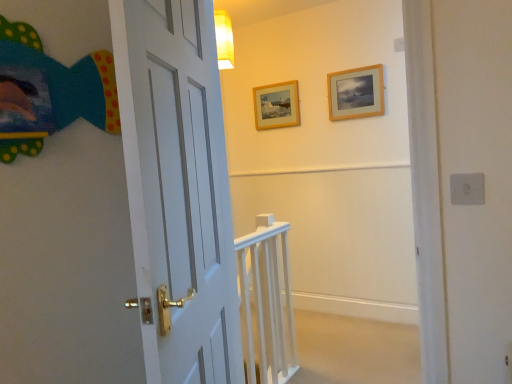
Describe the element at coordinates (276, 105) in the screenshot. I see `wooden picture frame at upper center, the second picture frame viewed from the right` at that location.

I want to click on wooden picture frame at upper center, marked as the first picture frame in a front-to-back arrangement, so click(x=356, y=93).

At what (x,y) coordinates should I click in order to perform the action: click on white wooden rail at center. Please return your answer as a coordinate pair (x, y). This screenshot has width=512, height=384. Looking at the image, I should click on tap(267, 301).

Identify the location of wooden picture frame at upper center, which is the 1th picture frame in left-to-right order. (276, 105).

Looking at this image, considering the sizes of white wooden rail at center and wooden picture frame at upper center, positioned as the second picture frame in back-to-front order, in the image, is white wooden rail at center wider or thinner than wooden picture frame at upper center, positioned as the second picture frame in back-to-front order,?

Considering their sizes, white wooden rail at center looks broader than wooden picture frame at upper center, positioned as the second picture frame in back-to-front order.

Looking at the image, does white wooden rail at center seem bigger or smaller compared to wooden picture frame at upper center, marked as the first picture frame in a front-to-back arrangement?

Considering their sizes, white wooden rail at center takes up more space than wooden picture frame at upper center, marked as the first picture frame in a front-to-back arrangement.

From a real-world perspective, is white wooden rail at center located higher than wooden picture frame at upper center, which appears as the second picture frame when viewed from the left?

No, from a real-world perspective, white wooden rail at center is not above wooden picture frame at upper center, which appears as the second picture frame when viewed from the left.

From the image's perspective, which object appears higher, white wooden rail at center or wooden picture frame at upper center, which appears as the second picture frame when viewed from the left?

wooden picture frame at upper center, which appears as the second picture frame when viewed from the left, from the image's perspective.

Could you tell me if white wooden rail at center is facing wooden picture frame at upper center, positioned as the 2th picture frame in front-to-back order?

No, white wooden rail at center is not facing towards wooden picture frame at upper center, positioned as the 2th picture frame in front-to-back order.

From a real-world perspective, is white wooden rail at center positioned under wooden picture frame at upper center, which is the 1th picture frame in left-to-right order, based on gravity?

Yes, from a real-world perspective, white wooden rail at center is below wooden picture frame at upper center, which is the 1th picture frame in left-to-right order.

Looking at this image, considering the relative sizes of wooden picture frame at upper center, arranged as the first picture frame when viewed from the back, and wooden picture frame at upper center, positioned as the second picture frame in back-to-front order, in the image provided, is wooden picture frame at upper center, arranged as the first picture frame when viewed from the back, bigger than wooden picture frame at upper center, positioned as the second picture frame in back-to-front order,?

No.

Considering their positions, is wooden picture frame at upper center, which is the 1th picture frame in left-to-right order, located in front of or behind wooden picture frame at upper center, positioned as the second picture frame in back-to-front order?

Clearly, wooden picture frame at upper center, which is the 1th picture frame in left-to-right order, is behind wooden picture frame at upper center, positioned as the second picture frame in back-to-front order.

Based on the photo, can you tell me how much wooden picture frame at upper center, which is the 1th picture frame in left-to-right order, and wooden picture frame at upper center, which is the 1th picture frame from right to left, differ in facing direction?

The angle between the facing direction of wooden picture frame at upper center, which is the 1th picture frame in left-to-right order, and the facing direction of wooden picture frame at upper center, which is the 1th picture frame from right to left, is 0.00231 degrees.

This screenshot has height=384, width=512. I want to click on picture frame located on the right of wooden picture frame at upper center, positioned as the 2th picture frame in front-to-back order, so click(356, 93).

Where is `picture frame that is below the wooden picture frame at upper center, which is the 1th picture frame from right to left (from the image's perspective)`? This screenshot has height=384, width=512. picture frame that is below the wooden picture frame at upper center, which is the 1th picture frame from right to left (from the image's perspective) is located at coordinates (276, 105).

Considering the positions of objects wooden picture frame at upper center, positioned as the second picture frame in back-to-front order, and wooden picture frame at upper center, arranged as the first picture frame when viewed from the back, in the image provided, who is in front, wooden picture frame at upper center, positioned as the second picture frame in back-to-front order, or wooden picture frame at upper center, arranged as the first picture frame when viewed from the back,?

Positioned in front is wooden picture frame at upper center, positioned as the second picture frame in back-to-front order.

Does wooden picture frame at upper center, marked as the first picture frame in a front-to-back arrangement, have a lesser width compared to wooden picture frame at upper center, the second picture frame viewed from the right?

No, wooden picture frame at upper center, marked as the first picture frame in a front-to-back arrangement, is not thinner than wooden picture frame at upper center, the second picture frame viewed from the right.

Would you say wooden picture frame at upper center, which is the 1th picture frame from right to left, is a long distance from wooden picture frame at upper center, arranged as the first picture frame when viewed from the back?

No, wooden picture frame at upper center, which is the 1th picture frame from right to left, is in close proximity to wooden picture frame at upper center, arranged as the first picture frame when viewed from the back.

From the image's perspective, is wooden picture frame at upper center, which appears as the second picture frame when viewed from the left, positioned above or below white wooden rail at center?

wooden picture frame at upper center, which appears as the second picture frame when viewed from the left, is situated higher than white wooden rail at center in the image.

From the picture: In the image, is wooden picture frame at upper center, which appears as the second picture frame when viewed from the left, positioned in front of or behind white wooden rail at center?

Visually, wooden picture frame at upper center, which appears as the second picture frame when viewed from the left, is located behind white wooden rail at center.

Is wooden picture frame at upper center, marked as the first picture frame in a front-to-back arrangement, inside the boundaries of white wooden rail at center, or outside?

wooden picture frame at upper center, marked as the first picture frame in a front-to-back arrangement, is outside white wooden rail at center.

Between point (291, 104) and point (255, 366), which one is positioned behind?

The point (291, 104) is behind.

How distant is wooden picture frame at upper center, arranged as the first picture frame when viewed from the back, from white wooden rail at center?

The distance of wooden picture frame at upper center, arranged as the first picture frame when viewed from the back, from white wooden rail at center is 5.00 feet.

Is wooden picture frame at upper center, which is the 1th picture frame in left-to-right order, not inside white wooden rail at center?

wooden picture frame at upper center, which is the 1th picture frame in left-to-right order, lies outside white wooden rail at center's area.

Where is `rail below the wooden picture frame at upper center, positioned as the second picture frame in back-to-front order (from a real-world perspective)`? The width and height of the screenshot is (512, 384). rail below the wooden picture frame at upper center, positioned as the second picture frame in back-to-front order (from a real-world perspective) is located at coordinates (267, 301).

You are a GUI agent. You are given a task and a screenshot of the screen. Output one action in this format:
    pyautogui.click(x=<x>, y=<y>)
    Task: Click on the rail below the wooden picture frame at upper center, the second picture frame viewed from the right (from the image's perspective)
    
    Given the screenshot: What is the action you would take?
    pyautogui.click(x=267, y=301)

Based on their spatial positions, is white wooden rail at center or wooden picture frame at upper center, marked as the first picture frame in a front-to-back arrangement, closer to wooden picture frame at upper center, which is the 1th picture frame in left-to-right order?

wooden picture frame at upper center, marked as the first picture frame in a front-to-back arrangement, is positioned closer to the anchor wooden picture frame at upper center, which is the 1th picture frame in left-to-right order.

Considering their positions, is wooden picture frame at upper center, which is the 1th picture frame in left-to-right order, positioned closer to white wooden rail at center than wooden picture frame at upper center, which appears as the second picture frame when viewed from the left?

wooden picture frame at upper center, which appears as the second picture frame when viewed from the left, is positioned closer to the anchor white wooden rail at center.

Estimate the real-world distances between objects in this image. Which object is closer to wooden picture frame at upper center, which is the 1th picture frame from right to left, white wooden rail at center or wooden picture frame at upper center, arranged as the first picture frame when viewed from the back?

wooden picture frame at upper center, arranged as the first picture frame when viewed from the back, is closer to wooden picture frame at upper center, which is the 1th picture frame from right to left.

From the image, which object appears to be nearer to wooden picture frame at upper center, marked as the first picture frame in a front-to-back arrangement, wooden picture frame at upper center, the second picture frame viewed from the right, or white wooden rail at center?

wooden picture frame at upper center, the second picture frame viewed from the right, is closer to wooden picture frame at upper center, marked as the first picture frame in a front-to-back arrangement.

When comparing their distances from white wooden rail at center, does wooden picture frame at upper center, positioned as the second picture frame in back-to-front order, or wooden picture frame at upper center, the second picture frame viewed from the right, seem further?

Among the two, wooden picture frame at upper center, the second picture frame viewed from the right, is located further to white wooden rail at center.

Based on their spatial positions, is wooden picture frame at upper center, which appears as the second picture frame when viewed from the left, or white wooden rail at center closer to wooden picture frame at upper center, the second picture frame viewed from the right?

wooden picture frame at upper center, which appears as the second picture frame when viewed from the left, lies closer to wooden picture frame at upper center, the second picture frame viewed from the right, than the other object.

You are a GUI agent. You are given a task and a screenshot of the screen. Output one action in this format:
    pyautogui.click(x=<x>, y=<y>)
    Task: Click on the picture frame between wooden picture frame at upper center, which is the 1th picture frame from right to left, and white wooden rail at center from top to bottom
    The height and width of the screenshot is (384, 512).
    Given the screenshot: What is the action you would take?
    pyautogui.click(x=276, y=105)